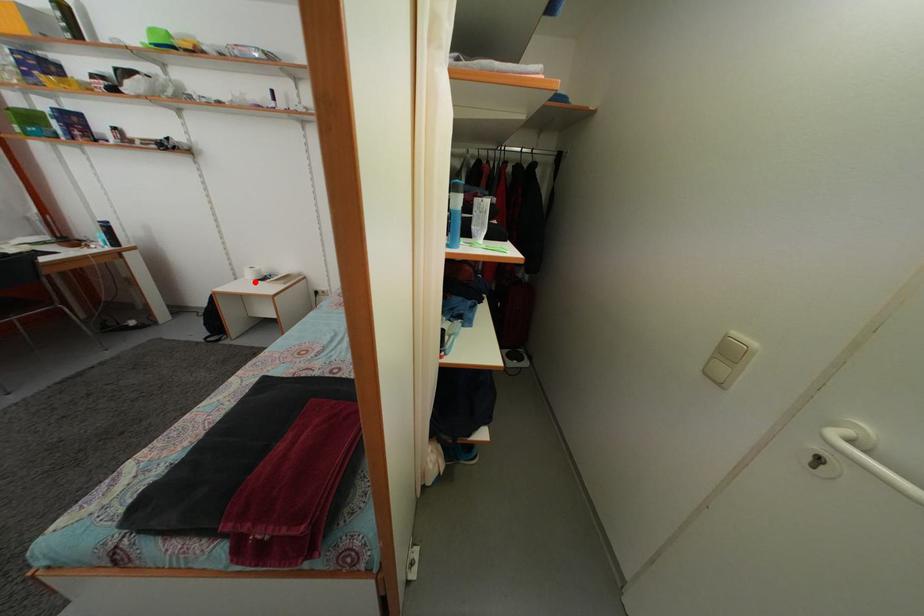
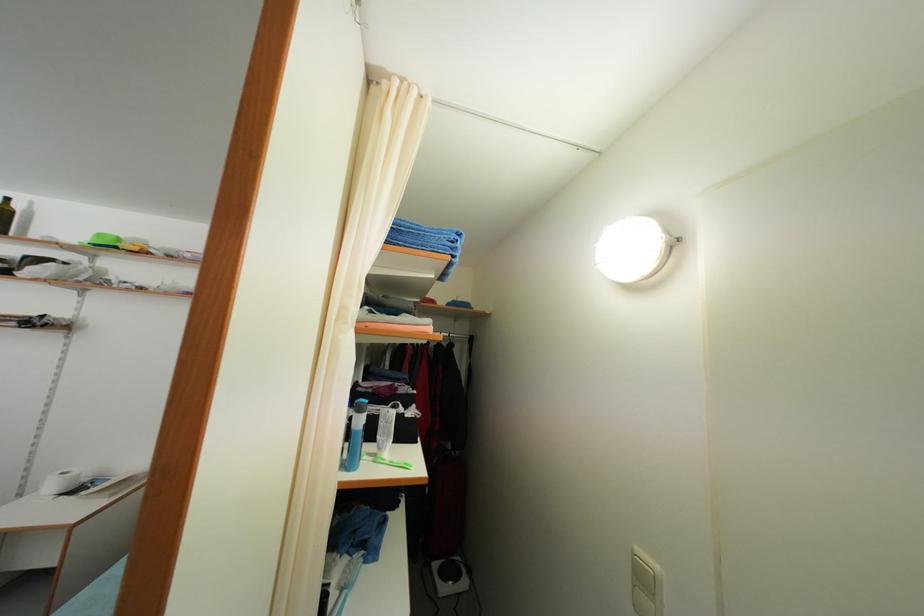
The point at the highlighted location is marked in the first image. Where is the corresponding point in the second image?

(56, 493)